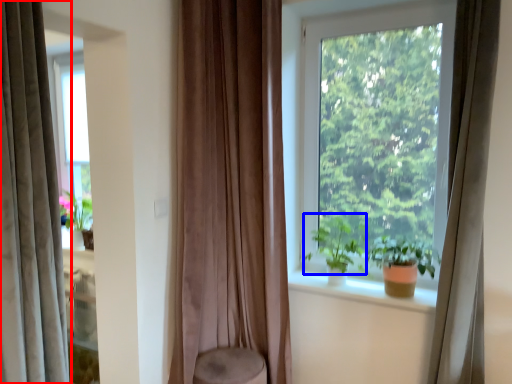
Question: Among these objects, which one is nearest to the camera, curtain (highlighted by a red box) or vegetation (highlighted by a blue box)?

Choices:
 (A) curtain
 (B) vegetation

Answer: (A)